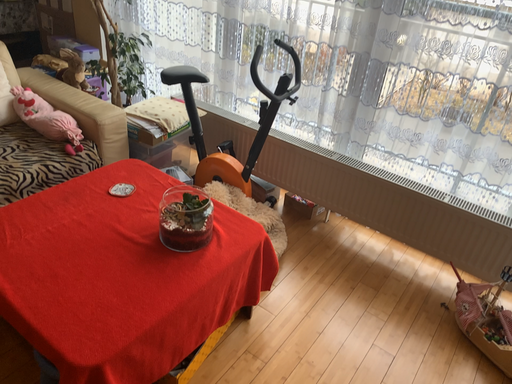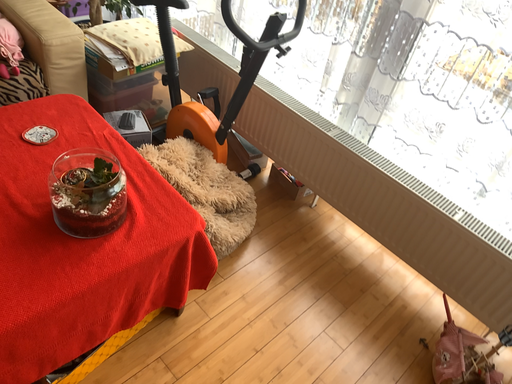
Question: Which way did the camera rotate in the video?

Choices:
 (A) rotated downward
 (B) rotated upward

Answer: (A)